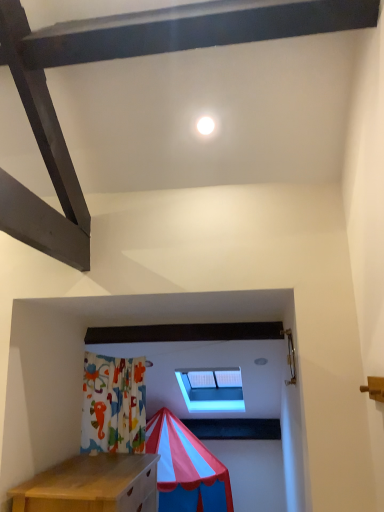
Question: From a real-world perspective, relative to transparent plastic window at center, is white glossy light at upper center vertically above or below?

Choices:
 (A) above
 (B) below

Answer: (A)

Question: From the image's perspective, relative to transparent plastic window at center, is white glossy light at upper center above or below?

Choices:
 (A) below
 (B) above

Answer: (B)

Question: Is white glossy light at upper center to the left or to the right of transparent plastic window at center in the image?

Choices:
 (A) right
 (B) left

Answer: (B)

Question: Is transparent plastic window at center taller or shorter than white glossy light at upper center?

Choices:
 (A) short
 (B) tall

Answer: (B)

Question: Based on their positions, is transparent plastic window at center located to the left or right of white glossy light at upper center?

Choices:
 (A) right
 (B) left

Answer: (A)

Question: Considering the positions of transparent plastic window at center and white glossy light at upper center in the image, is transparent plastic window at center bigger or smaller than white glossy light at upper center?

Choices:
 (A) small
 (B) big

Answer: (B)

Question: Relative to white glossy light at upper center, is transparent plastic window at center in front or behind?

Choices:
 (A) front
 (B) behind

Answer: (B)